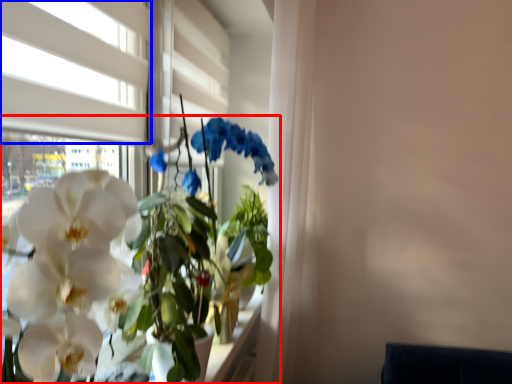
Question: Among these objects, which one is farthest to the camera, houseplant (highlighted by a red box) or window (highlighted by a blue box)?

Choices:
 (A) houseplant
 (B) window

Answer: (B)